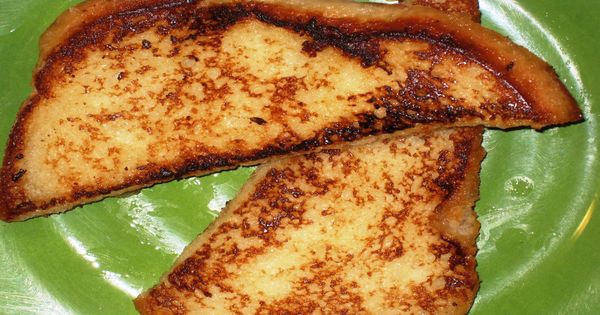
I want to click on green dinner plate, so [x=534, y=277].